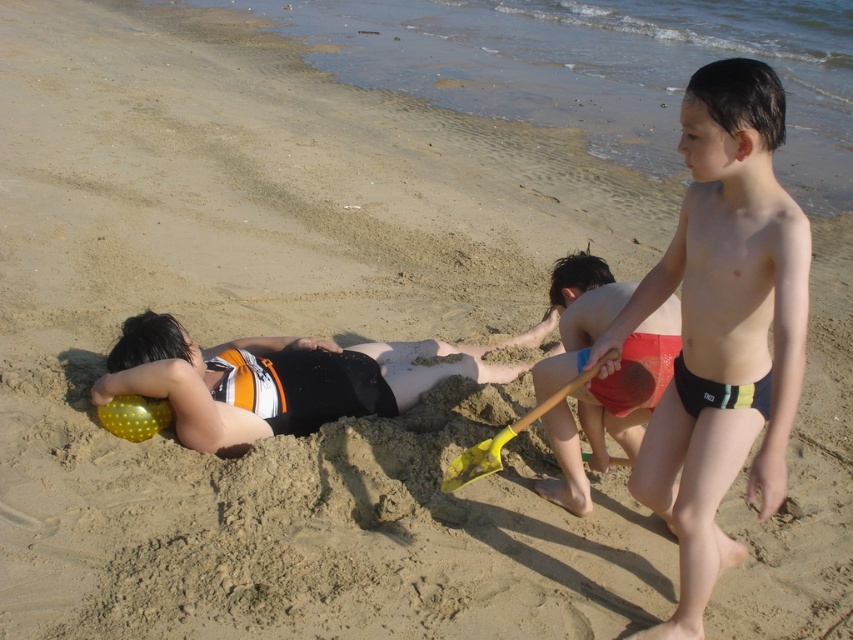
You are a lifeguard observing the beach scene. You notice two children playing near the water. One is wearing multicolored swim trunks at center. Where is this child positioned relative to the other children and the shoreline?

The multicolored swim trunks at center is located at point (723,326), which places them centrally on the beach, closer to the shoreline compared to the other children who are further inland.

You are a photographer trying to capture a photo of the children on the beach. You need to ensure that both the multicolored swim trunks at center and the red fabric shorts at center are clearly visible in the frame. Which of the two clothing items should you focus on first to ensure proper exposure, considering their size?

The multicolored swim trunks at center has a larger size compared to the red fabric shorts at center, so focusing on the multicolored swim trunks at center first will ensure proper exposure since it occupies more space in the frame.

You are a parent at the beach who wants to retrieve the yellow plastic shovel at center from the sand. Your child is currently lying on their stomach in the black swimsuit at center. Can you reach the shovel without disturbing your child?

The distance between the black swimsuit at center and the yellow plastic shovel at center is 1.04 meters, so yes, you can reach the shovel without disturbing your child since the distance is manageable.